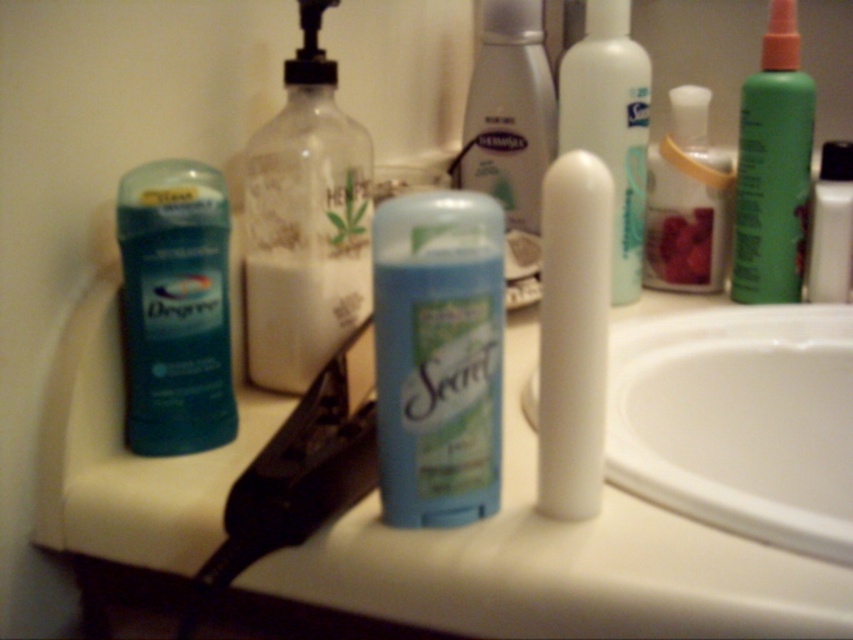
Locate an element on the screen. This screenshot has width=853, height=640. white ceramic sink at lower right is located at coordinates (740, 420).

Is point (764, 380) farther from camera compared to point (610, 76)?

That is False.

Between point (643, 342) and point (596, 108), which one is positioned behind?

Point (596, 108)

Where is `white ceramic sink at lower right`? white ceramic sink at lower right is located at coordinates (740, 420).

Who is positioned more to the right, green matte bottle at upper right or white matte lotion at center?

green matte bottle at upper right

Can you confirm if green matte bottle at upper right is shorter than white matte lotion at center?

Yes, green matte bottle at upper right is shorter than white matte lotion at center.

Which is behind, point (809, 180) or point (612, 83)?

Point (809, 180)

This screenshot has width=853, height=640. Find the location of `green matte bottle at upper right`. green matte bottle at upper right is located at coordinates (772, 168).

Is translucent plastic mouthwash at center below white matte lotion at upper right?

Correct, translucent plastic mouthwash at center is located below white matte lotion at upper right.

Which of these two, translucent plastic mouthwash at center or white matte lotion at upper right, stands taller?

translucent plastic mouthwash at center is taller.

This screenshot has height=640, width=853. Describe the element at coordinates (305, 221) in the screenshot. I see `translucent plastic mouthwash at center` at that location.

This screenshot has width=853, height=640. Find the location of `translucent plastic mouthwash at center`. translucent plastic mouthwash at center is located at coordinates (305, 221).